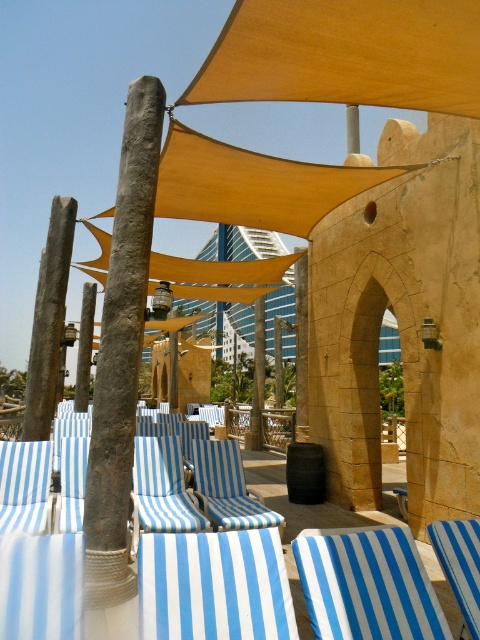
Which is in front, point (418, 637) or point (9, 474)?

Point (418, 637) is more forward.

The width and height of the screenshot is (480, 640). Find the location of `blue striped fabric beach chair at lower center`. blue striped fabric beach chair at lower center is located at coordinates (367, 584).

Is matte yellow fabric canopy at upper center closer to the viewer compared to blue striped fabric beach chair at left?

Yes, matte yellow fabric canopy at upper center is closer to the viewer.

Which is behind, point (322, 1) or point (3, 442)?

The point (3, 442) is behind.

At what (x,y) coordinates should I click in order to perform the action: click on matte yellow fabric canopy at upper center. Please return your answer as a coordinate pair (x, y). Looking at the image, I should click on 346,54.

Consider the image. Can you confirm if matte yellow fabric canopy at upper center is bigger than blue striped fabric beach chair at lower right?

A: Correct, matte yellow fabric canopy at upper center is larger in size than blue striped fabric beach chair at lower right.

Who is more forward, (x=399, y=68) or (x=454, y=541)?

Point (x=454, y=541) is in front.

Does point (309, 61) come behind point (478, 636)?

Yes, it is behind point (478, 636).

This screenshot has width=480, height=640. I want to click on matte yellow fabric canopy at upper center, so click(346, 54).